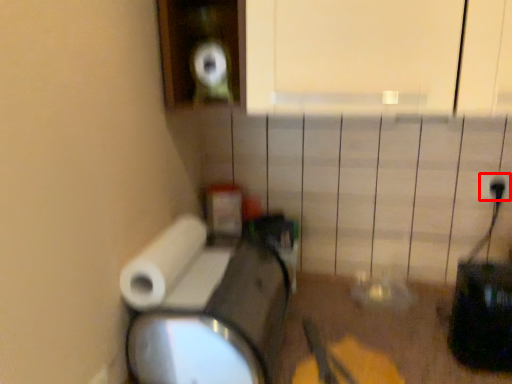
Question: From the image's perspective, what is the correct spatial positioning of electric outlet (annotated by the red box) in reference to toilet paper?

Choices:
 (A) below
 (B) above

Answer: (B)